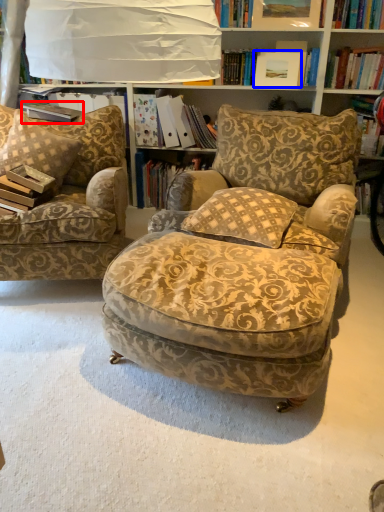
Question: Among these objects, which one is nearest to the camera, paperback book (highlighted by a red box) or picture frame (highlighted by a blue box)?

Choices:
 (A) paperback book
 (B) picture frame

Answer: (A)